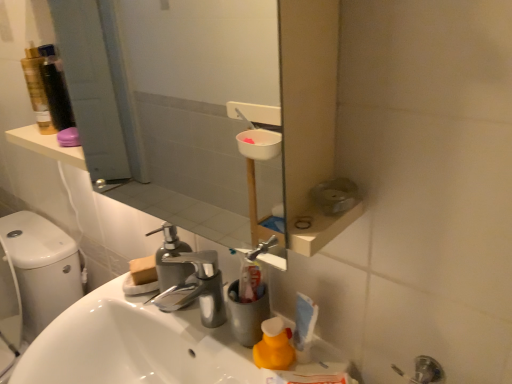
Question: Considering the relative sizes of white glossy sink at center and yellow matte cleaning product at lower center in the image provided, is white glossy sink at center smaller than yellow matte cleaning product at lower center?

Choices:
 (A) yes
 (B) no

Answer: (B)

Question: From the image's perspective, does white glossy sink at center appear lower than yellow matte cleaning product at lower center?

Choices:
 (A) yes
 (B) no

Answer: (A)

Question: Does white glossy sink at center appear on the right side of yellow matte cleaning product at lower center?

Choices:
 (A) no
 (B) yes

Answer: (A)

Question: Is white glossy sink at center oriented away from yellow matte cleaning product at lower center?

Choices:
 (A) no
 (B) yes

Answer: (A)

Question: Does white glossy sink at center lie behind yellow matte cleaning product at lower center?

Choices:
 (A) yes
 (B) no

Answer: (B)

Question: From the image's perspective, is yellow matte cleaning product at lower center located above or below chrome metallic faucet at center?

Choices:
 (A) below
 (B) above

Answer: (A)

Question: Is point (286, 342) closer or farther from the camera than point (209, 286)?

Choices:
 (A) farther
 (B) closer

Answer: (B)

Question: From a real-world perspective, relative to chrome metallic faucet at center, is yellow matte cleaning product at lower center vertically above or below?

Choices:
 (A) below
 (B) above

Answer: (A)

Question: In terms of height, does yellow matte cleaning product at lower center look taller or shorter compared to chrome metallic faucet at center?

Choices:
 (A) tall
 (B) short

Answer: (B)

Question: Based on their sizes in the image, would you say white glossy sink at center is bigger or smaller than clear glass mirror at upper center?

Choices:
 (A) big
 (B) small

Answer: (B)

Question: Is white glossy sink at center inside the boundaries of clear glass mirror at upper center, or outside?

Choices:
 (A) outside
 (B) inside

Answer: (A)

Question: From a real-world perspective, relative to clear glass mirror at upper center, is white glossy sink at center vertically above or below?

Choices:
 (A) below
 (B) above

Answer: (A)

Question: Considering the positions of white glossy sink at center and clear glass mirror at upper center in the image, is white glossy sink at center taller or shorter than clear glass mirror at upper center?

Choices:
 (A) tall
 (B) short

Answer: (B)

Question: In terms of height, does white glossy sink at center look taller or shorter compared to yellow matte cleaning product at lower center?

Choices:
 (A) tall
 (B) short

Answer: (A)

Question: In the image, is white glossy sink at center positioned in front of or behind yellow matte cleaning product at lower center?

Choices:
 (A) behind
 (B) front

Answer: (B)